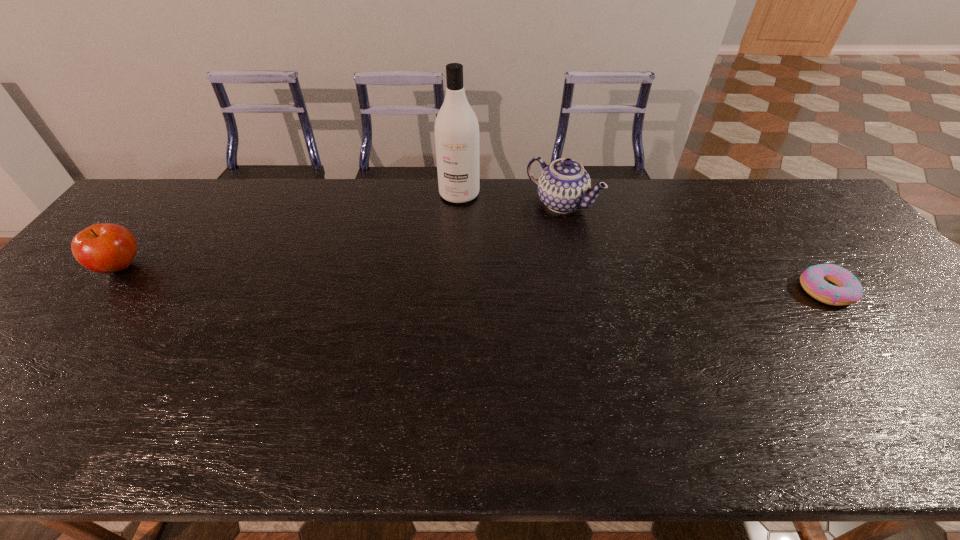
This screenshot has height=540, width=960. I want to click on vacant space at the far edge, so click(629, 192).

This screenshot has height=540, width=960. In the image, there is a desktop. Find the location of `vacant space at the near edge`. vacant space at the near edge is located at coordinates (52, 401).

Identify the location of vacant space at the far right corner. This screenshot has width=960, height=540. (818, 223).

Where is `vacant point located between the leftmost object and the doughnut`? The width and height of the screenshot is (960, 540). vacant point located between the leftmost object and the doughnut is located at coordinates [473, 279].

Image resolution: width=960 pixels, height=540 pixels. What are the coordinates of `free space between the shortest object and the leftmost object` in the screenshot? It's located at (473, 279).

This screenshot has height=540, width=960. Find the location of `empty location between the third shortest object and the doughnut`. empty location between the third shortest object and the doughnut is located at coordinates (693, 247).

Where is `free space between the chinaware and the apple`? This screenshot has width=960, height=540. free space between the chinaware and the apple is located at coordinates (341, 235).

The width and height of the screenshot is (960, 540). Identify the location of free spot between the doughnut and the shampoo. (642, 242).

Where is `free space between the apple and the shampoo`? The width and height of the screenshot is (960, 540). free space between the apple and the shampoo is located at coordinates (290, 231).

Where is `vacant point located between the leftmost object and the doughnut`? The height and width of the screenshot is (540, 960). vacant point located between the leftmost object and the doughnut is located at coordinates (473, 279).